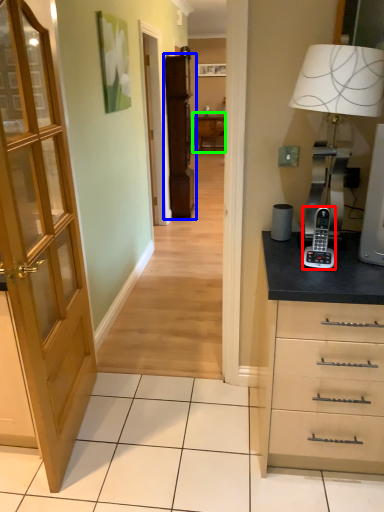
Question: Which object is the closest to the gadget (highlighted by a red box)? Choose among these: file cabinet (highlighted by a blue box) or table (highlighted by a green box).

Choices:
 (A) file cabinet
 (B) table

Answer: (A)